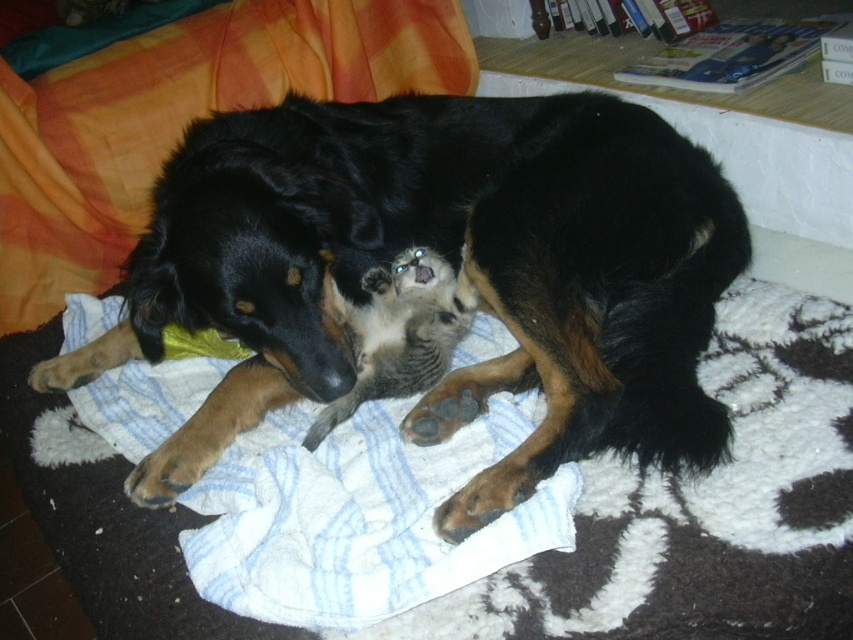
You are a pet owner trying to decide if your black fur dog at center can comfortably stretch out on the white soft dog bed at center. Based on their sizes, is the bed big enough?

The black fur dog at center has a lesser width compared to the white soft dog bed at center, so the bed should be big enough for the dog to stretch out comfortably.

You are a pet owner who wants to ensure your pets are safe. You see the black fur dog at center and the white soft dog bed at center in the image. Which object is directly on top of the other?

The black fur dog at center is positioned over white soft dog bed at center, so the dog is directly on top of the bed.

You are a pet owner trying to locate your black fur dog at center and white soft dog bed at center in the image. From the perspective of someone looking at the image, which object is positioned to the left?

The white soft dog bed at center is positioned to the left of the black fur dog at center.